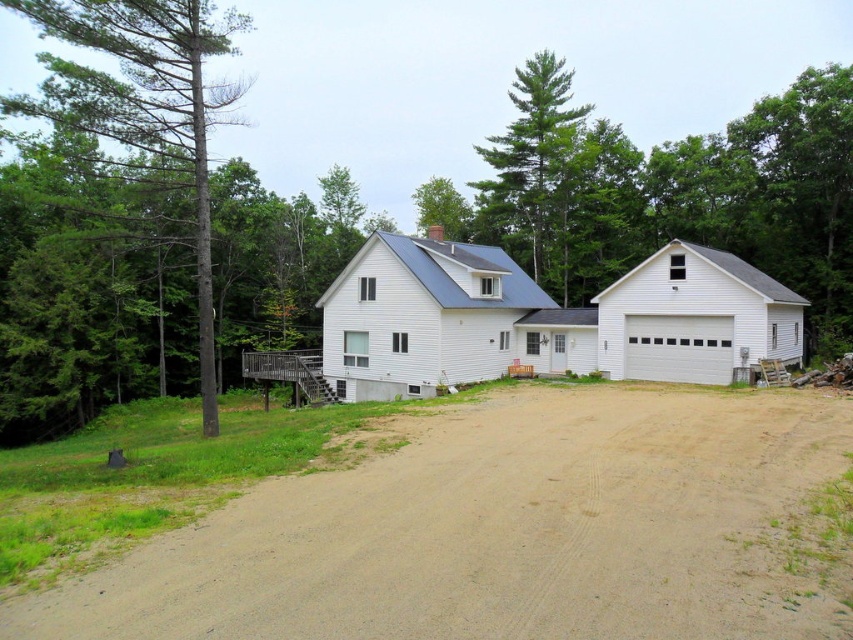
Locate an element on the screen. This screenshot has height=640, width=853. green textured tree at left is located at coordinates (149, 102).

How far apart are green textured tree at left and green leafy tree at upper center?

green textured tree at left and green leafy tree at upper center are 33.67 meters apart from each other.

Between point (200, 218) and point (422, 182), which one is positioned in front?

Point (200, 218) is in front.

Where is `green textured tree at left`? Image resolution: width=853 pixels, height=640 pixels. green textured tree at left is located at coordinates (149, 102).

Is white matte garage at center positioned behind white smooth garage at center?

That is False.

Is white matte garage at center positioned in front of white smooth garage at center?

Yes.

Image resolution: width=853 pixels, height=640 pixels. Describe the element at coordinates (544, 317) in the screenshot. I see `white matte garage at center` at that location.

Locate an element on the screen. The height and width of the screenshot is (640, 853). white matte garage at center is located at coordinates (544, 317).

Can you confirm if brown dirt at center is wider than white smooth garage at center?

No, brown dirt at center is not wider than white smooth garage at center.

Which is more to the left, brown dirt at center or white smooth garage at center?

white smooth garage at center

Identify the location of brown dirt at center. Image resolution: width=853 pixels, height=640 pixels. (502, 531).